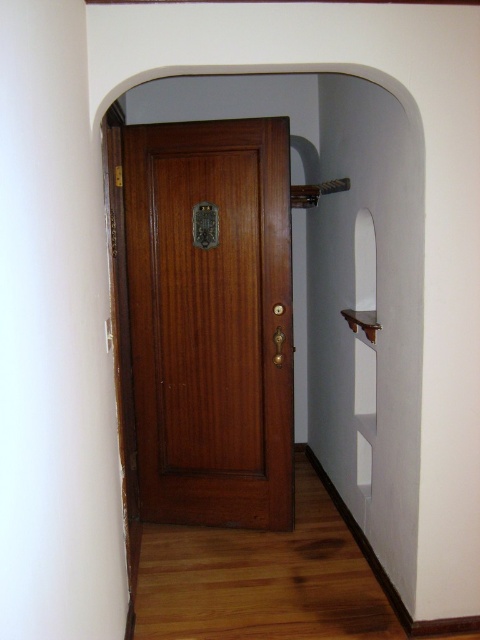
Who is shorter, polished wood door at center or wooden door at center?

polished wood door at center is shorter.

Consider the image. Does polished wood door at center come in front of wooden door at center?

No.

I want to click on polished wood door at center, so click(x=212, y=321).

Find the location of a particular element. This screenshot has width=480, height=640. polished wood door at center is located at coordinates (212, 321).